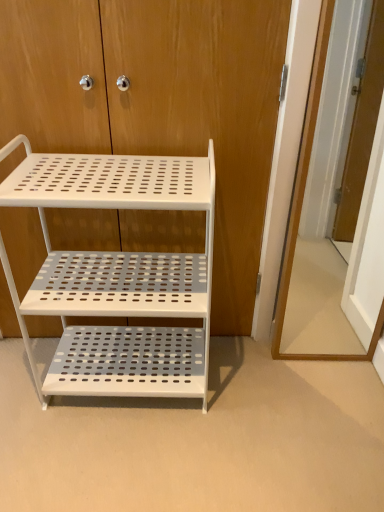
You are a GUI agent. You are given a task and a screenshot of the screen. Output one action in this format:
    pyautogui.click(x=<x>, y=<y>)
    Task: Click on the vacant space behind wooden door at right
    This screenshot has height=512, width=384.
    Given the screenshot: What is the action you would take?
    pyautogui.click(x=313, y=333)